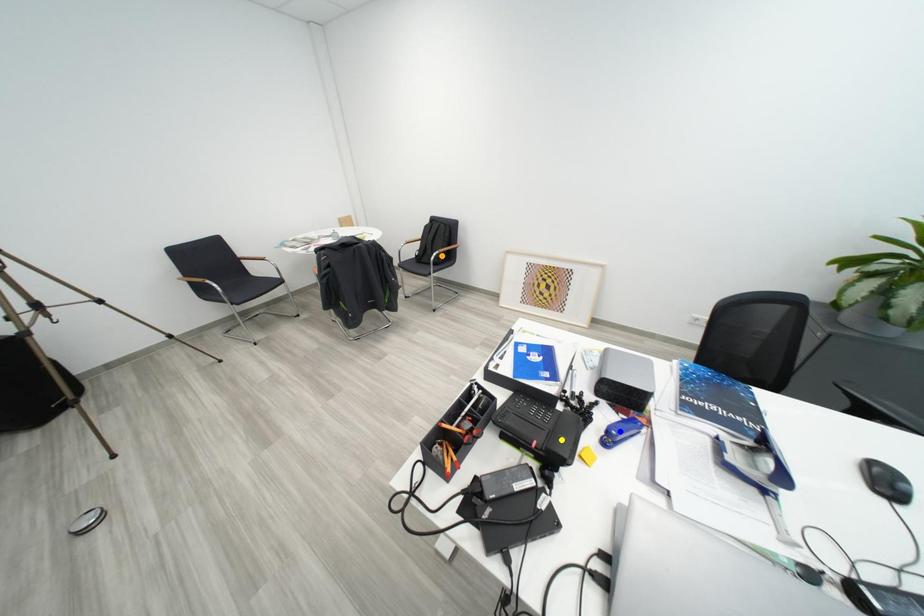
Order these from nearest to farthest:
orange point
yellow point
blue point

yellow point → blue point → orange point